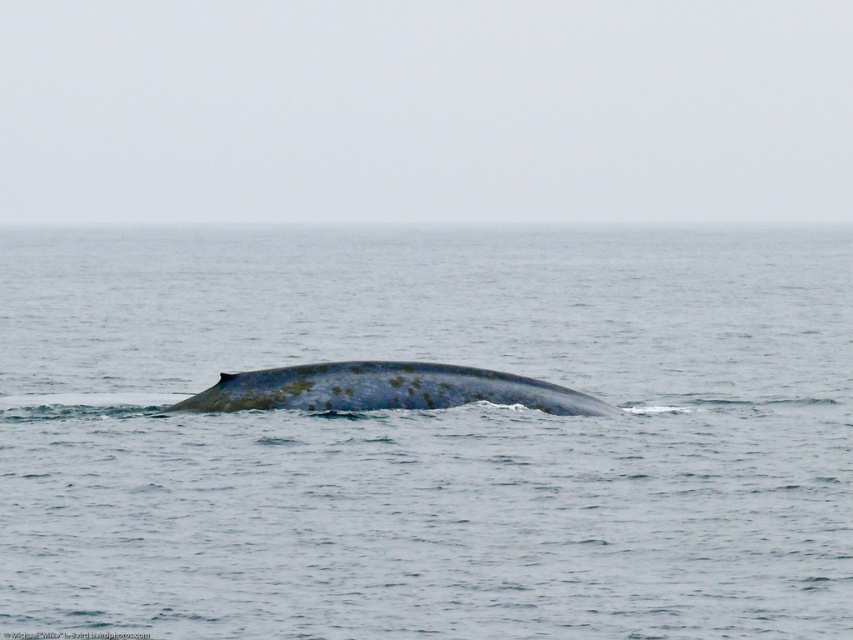
Does blue matte water at center have a larger size compared to blue matte whale at center?

Indeed, blue matte water at center has a larger size compared to blue matte whale at center.

Which of these two, blue matte water at center or blue matte whale at center, stands taller?

With more height is blue matte water at center.

Where is `blue matte water at center`? This screenshot has height=640, width=853. blue matte water at center is located at coordinates (428, 433).